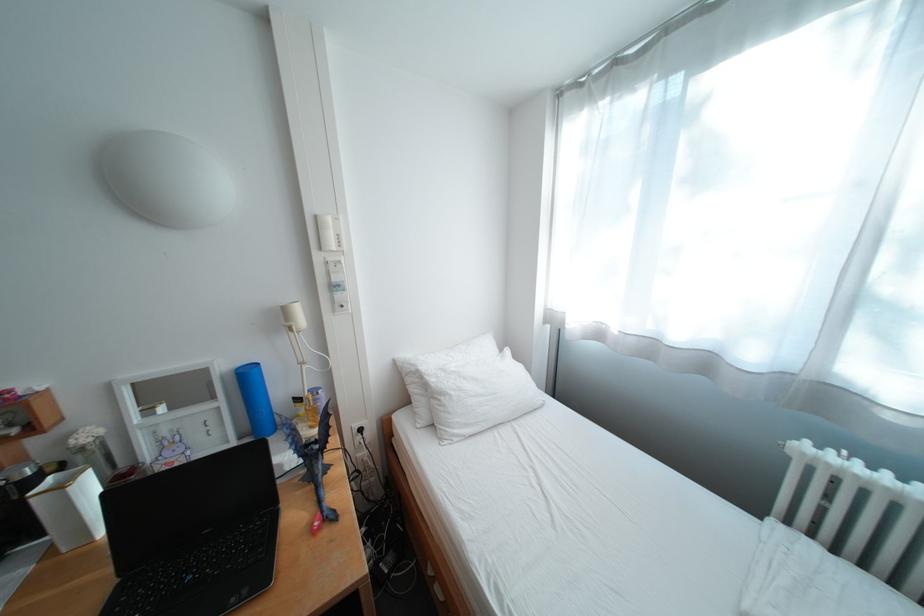
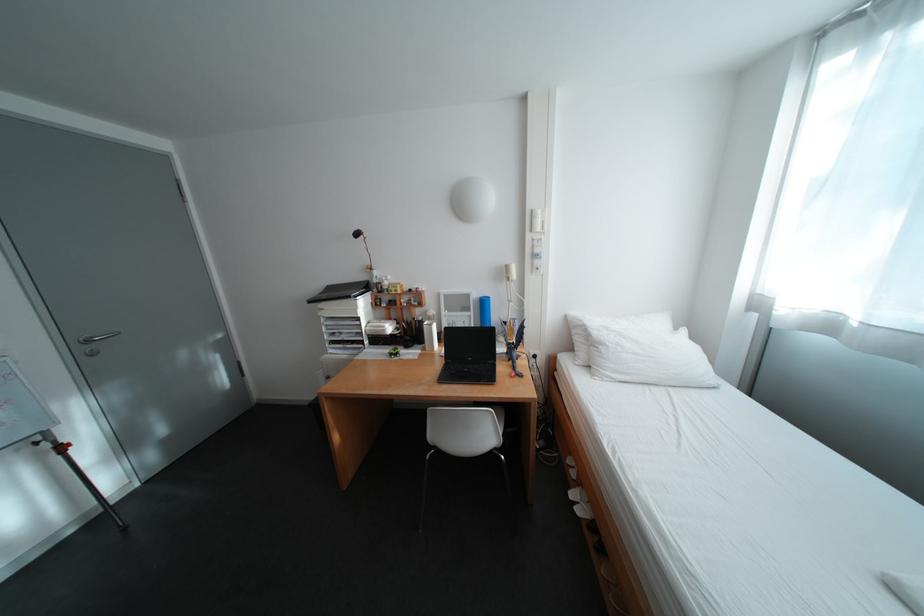
Question: I am providing you with two images of the same scene from different viewpoints. Which of the following objects are not visible in image2?

Choices:
 (A) white tape dispenser
 (B) blue water bottle
 (C) silver door handle
 (D) none of these

Answer: (D)